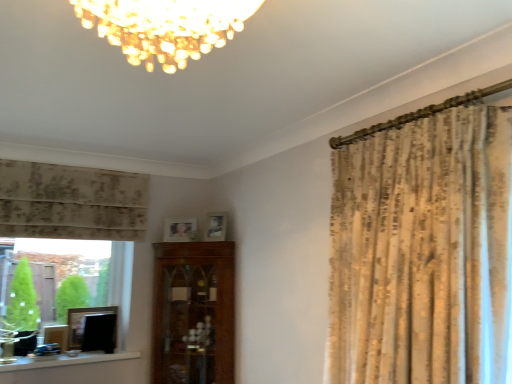
Locate an element on the screen. This screenshot has height=384, width=512. wooden picture frame at lower left, the 4th picture frame in the right-to-left sequence is located at coordinates (56, 336).

You are a GUI agent. You are given a task and a screenshot of the screen. Output one action in this format:
    pyautogui.click(x=<x>, y=<y>)
    Task: Click on the green glass at left
    The image size is (512, 384).
    Given the screenshot: What is the action you would take?
    pyautogui.click(x=96, y=270)

What do you see at coordinates (180, 230) in the screenshot?
I see `matte wooden picture frame at center, the second picture frame positioned from the right` at bounding box center [180, 230].

Locate an element on the screen. The width and height of the screenshot is (512, 384). neutral floral fabric curtain at left is located at coordinates (71, 202).

In the image, is matte wooden picture frame at upper center, placed as the 4th picture frame when sorted from bottom to top, on the left side or the right side of matte black picture frame at lower left, which appears as the second picture frame when viewed from the left?

Clearly, matte wooden picture frame at upper center, placed as the 4th picture frame when sorted from bottom to top, is on the right of matte black picture frame at lower left, which appears as the second picture frame when viewed from the left, in the image.

In the scene shown: Does matte wooden picture frame at upper center, which is the 1th picture frame in right-to-left order, turn towards matte black picture frame at lower left, which appears as the second picture frame when viewed from the left?

No.

From the picture: Which object is wider, matte wooden picture frame at upper center, the 1th picture frame in the top-to-bottom sequence, or matte black picture frame at lower left, which appears as the second picture frame when viewed from the left?

matte wooden picture frame at upper center, the 1th picture frame in the top-to-bottom sequence, is wider.

Considering the positions of point (58, 341) and point (123, 297), is point (58, 341) closer or farther from the camera than point (123, 297)?

Point (58, 341).

Does wooden picture frame at lower left, the 4th picture frame in the right-to-left sequence, have a greater width compared to green glass at left?

Incorrect, the width of wooden picture frame at lower left, the 4th picture frame in the right-to-left sequence, does not surpass that of green glass at left.

Which object is closer to the camera taking this photo, wooden picture frame at lower left, the 1th picture frame when ordered from bottom to top, or green glass at left?

green glass at left.

Between point (98, 264) and point (216, 228), which one is positioned in front?

Point (216, 228)

Which object is further away from the camera, green glass at left or matte wooden picture frame at upper center, placed as the 4th picture frame when sorted from bottom to top?

matte wooden picture frame at upper center, placed as the 4th picture frame when sorted from bottom to top.

From the image's perspective, is green glass at left under matte wooden picture frame at upper center, placed as the 4th picture frame when sorted from bottom to top?

Yes.

Does green glass at left have a lesser height compared to matte wooden picture frame at upper center, which is the fourth picture frame in left-to-right order?

In fact, green glass at left may be taller than matte wooden picture frame at upper center, which is the fourth picture frame in left-to-right order.

Which of these two, matte wooden picture frame at center, positioned as the 3th picture frame in bottom-to-top order, or white painted wood at lower left, is bigger?

white painted wood at lower left.

Could you measure the distance between matte wooden picture frame at center, the second picture frame from the top, and white painted wood at lower left?

They are 34.83 inches apart.

Is matte wooden picture frame at center, positioned as the 3th picture frame in bottom-to-top order, oriented away from white painted wood at lower left?

matte wooden picture frame at center, positioned as the 3th picture frame in bottom-to-top order, is not turned away from white painted wood at lower left.

Is matte wooden picture frame at center, the second picture frame from the top, further to camera compared to white painted wood at lower left?

Yes, matte wooden picture frame at center, the second picture frame from the top, is further from the viewer.

Is matte wooden picture frame at center, the second picture frame positioned from the right, positioned behind matte black picture frame at lower left, the 3th picture frame viewed from the right?

Yes, matte wooden picture frame at center, the second picture frame positioned from the right, is behind matte black picture frame at lower left, the 3th picture frame viewed from the right.

Is matte wooden picture frame at center, the second picture frame positioned from the right, with matte black picture frame at lower left, which ranks as the 2th picture frame in bottom-to-top order?

There is a gap between matte wooden picture frame at center, the second picture frame positioned from the right, and matte black picture frame at lower left, which ranks as the 2th picture frame in bottom-to-top order.

Can you confirm if matte wooden picture frame at center, the second picture frame positioned from the right, is thinner than matte black picture frame at lower left, marked as the 3th picture frame in a top-to-bottom arrangement?

Yes.

From the image's perspective, is matte wooden picture frame at center, which is the 3th picture frame in left-to-right order, located beneath matte black picture frame at lower left, which appears as the second picture frame when viewed from the left?

No, from the image's perspective, matte wooden picture frame at center, which is the 3th picture frame in left-to-right order, is not below matte black picture frame at lower left, which appears as the second picture frame when viewed from the left.

From the picture: Does matte black picture frame at lower left, which ranks as the 2th picture frame in bottom-to-top order, appear on the right side of green glass at left?

Answer: Indeed, matte black picture frame at lower left, which ranks as the 2th picture frame in bottom-to-top order, is positioned on the right side of green glass at left.

Are matte black picture frame at lower left, which appears as the second picture frame when viewed from the left, and green glass at left beside each other?

There is a gap between matte black picture frame at lower left, which appears as the second picture frame when viewed from the left, and green glass at left.

Is matte black picture frame at lower left, which appears as the second picture frame when viewed from the left, shorter than green glass at left?

Correct, matte black picture frame at lower left, which appears as the second picture frame when viewed from the left, is not as tall as green glass at left.

Which object is further away from the camera taking this photo, matte black picture frame at lower left, which ranks as the 2th picture frame in bottom-to-top order, or green glass at left?

matte black picture frame at lower left, which ranks as the 2th picture frame in bottom-to-top order, is further away from the camera.

What's the angular difference between matte wooden picture frame at upper center, which is the 1th picture frame in right-to-left order, and green glass at left's facing directions?

54.4 degrees.

Would you say matte wooden picture frame at upper center, which is the 1th picture frame in right-to-left order, is inside or outside green glass at left?

matte wooden picture frame at upper center, which is the 1th picture frame in right-to-left order, lies outside green glass at left.

Which object is closer to the camera taking this photo, matte wooden picture frame at upper center, the 1th picture frame in the top-to-bottom sequence, or green glass at left?

green glass at left.

From the matte wooden picture frame at upper center, the 1th picture frame in the top-to-bottom sequence, count the 2nd picture frame to the left and point to it. Please provide its 2D coordinates.

[(82, 322)]

The width and height of the screenshot is (512, 384). I want to click on bay window that is in front of the wooden picture frame at lower left, the 4th picture frame in the right-to-left sequence, so click(96, 270).

From the image, which object appears to be farther from green glass at left, matte wooden picture frame at upper center, placed as the 4th picture frame when sorted from bottom to top, or matte black picture frame at lower left, which ranks as the 2th picture frame in bottom-to-top order?

matte wooden picture frame at upper center, placed as the 4th picture frame when sorted from bottom to top, is further to green glass at left.

Considering their positions, is neutral floral fabric curtain at left positioned closer to wooden picture frame at lower left, the 4th picture frame in the right-to-left sequence, than green glass at left?

The object closer to wooden picture frame at lower left, the 4th picture frame in the right-to-left sequence, is green glass at left.

Estimate the real-world distances between objects in this image. Which object is closer to white painted wood at lower left, green glass at left or wooden picture frame at lower left, positioned as the first picture frame in left-to-right order?

Based on the image, wooden picture frame at lower left, positioned as the first picture frame in left-to-right order, appears to be nearer to white painted wood at lower left.

Considering their positions, is matte wooden picture frame at center, the second picture frame positioned from the right, positioned further to green glass at left than wooden picture frame at lower left, the 1th picture frame when ordered from bottom to top?

matte wooden picture frame at center, the second picture frame positioned from the right, lies further to green glass at left than the other object.

Looking at the image, which one is located further to neutral floral fabric curtain at left, matte wooden picture frame at center, the second picture frame from the top, or green glass at left?

matte wooden picture frame at center, the second picture frame from the top, is further to neutral floral fabric curtain at left.

Looking at the image, which one is located closer to neutral floral fabric curtain at left, matte black picture frame at lower left, which appears as the second picture frame when viewed from the left, or white painted wood at lower left?

matte black picture frame at lower left, which appears as the second picture frame when viewed from the left.

When comparing their distances from matte wooden picture frame at center, the second picture frame positioned from the right, does white painted wood at lower left or matte wooden picture frame at upper center, which is the 1th picture frame in right-to-left order, seem further?

The object further to matte wooden picture frame at center, the second picture frame positioned from the right, is white painted wood at lower left.

Consider the image. Which object lies further to the anchor point matte wooden picture frame at center, the second picture frame positioned from the right, neutral floral fabric curtain at left or green glass at left?

Based on the image, neutral floral fabric curtain at left appears to be further to matte wooden picture frame at center, the second picture frame positioned from the right.

This screenshot has height=384, width=512. In order to click on picture frame between matte black picture frame at lower left, which appears as the second picture frame when viewed from the left, and matte wooden picture frame at upper center, which is the fourth picture frame in left-to-right order in this screenshot , I will do `click(180, 230)`.

In order to click on curtain between green glass at left and matte wooden picture frame at center, the second picture frame from the top, in the horizontal direction in this screenshot , I will do [x=71, y=202].

This screenshot has width=512, height=384. In order to click on picture frame that lies between green glass at left and wooden picture frame at lower left, the 4th picture frame in the right-to-left sequence, from top to bottom in this screenshot , I will do `click(82, 322)`.

This screenshot has width=512, height=384. What are the coordinates of `bay window that lies between neutral floral fabric curtain at left and matte black picture frame at lower left, which appears as the second picture frame when viewed from the left, from top to bottom` in the screenshot? It's located at (96, 270).